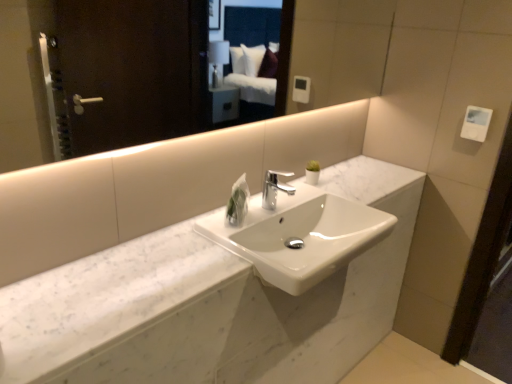
Question: From the image's perspective, does white marble counter at center appear higher than white marble sink at center?

Choices:
 (A) no
 (B) yes

Answer: (B)

Question: Is white marble counter at center behind white marble sink at center?

Choices:
 (A) yes
 (B) no

Answer: (B)

Question: Is white marble sink at center at the back of white marble counter at center?

Choices:
 (A) no
 (B) yes

Answer: (B)

Question: Is white marble counter at center facing towards white marble sink at center?

Choices:
 (A) no
 (B) yes

Answer: (B)

Question: From a real-world perspective, is white marble counter at center under white marble sink at center?

Choices:
 (A) no
 (B) yes

Answer: (A)

Question: Does white marble counter at center have a smaller size compared to white marble sink at center?

Choices:
 (A) no
 (B) yes

Answer: (B)

Question: Can you confirm if white glossy mirror at upper center is thinner than polished chrome faucet at center?

Choices:
 (A) no
 (B) yes

Answer: (B)

Question: Is white glossy mirror at upper center with polished chrome faucet at center?

Choices:
 (A) yes
 (B) no

Answer: (B)

Question: Can you confirm if white glossy mirror at upper center is positioned to the right of polished chrome faucet at center?

Choices:
 (A) yes
 (B) no

Answer: (B)

Question: From the image's perspective, is white glossy mirror at upper center below polished chrome faucet at center?

Choices:
 (A) no
 (B) yes

Answer: (A)

Question: Is white glossy mirror at upper center behind polished chrome faucet at center?

Choices:
 (A) yes
 (B) no

Answer: (B)

Question: Is white glossy mirror at upper center not close to polished chrome faucet at center?

Choices:
 (A) no
 (B) yes

Answer: (A)

Question: Is polished chrome faucet at center completely or partially inside white marble sink at center?

Choices:
 (A) yes
 (B) no

Answer: (B)